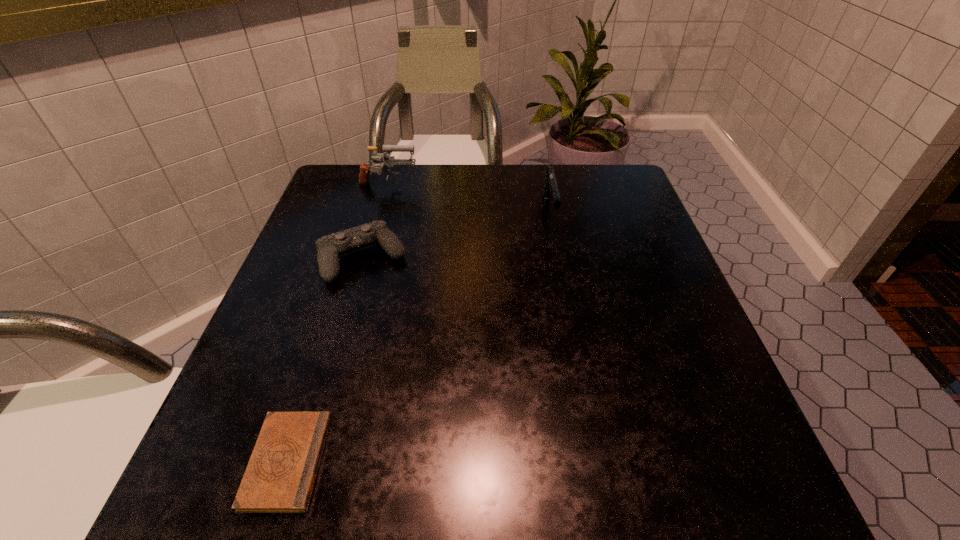
Where is `the tallest object`? the tallest object is located at coordinates (389, 161).

Where is `the left gun`? The width and height of the screenshot is (960, 540). the left gun is located at coordinates (389, 161).

Image resolution: width=960 pixels, height=540 pixels. I want to click on the right gun, so (550, 187).

You are a GUI agent. You are given a task and a screenshot of the screen. Output one action in this format:
    pyautogui.click(x=<x>, y=<y>)
    Task: Click on the rightmost object
    This screenshot has height=540, width=960.
    Given the screenshot: What is the action you would take?
    pyautogui.click(x=550, y=187)

Locate an element on the screen. This screenshot has width=960, height=540. the third tallest object is located at coordinates (330, 247).

The height and width of the screenshot is (540, 960). Identify the location of the third farthest object. click(x=330, y=247).

Identify the location of diary. Image resolution: width=960 pixels, height=540 pixels. (280, 476).

Identify the location of the shortest object. (280, 476).

I want to click on free space located 0.100m at the barrel end of the taller gun, so click(x=456, y=186).

Identify the location of vacant area situated at the aiming end of the shorter gun. This screenshot has width=960, height=540. (566, 299).